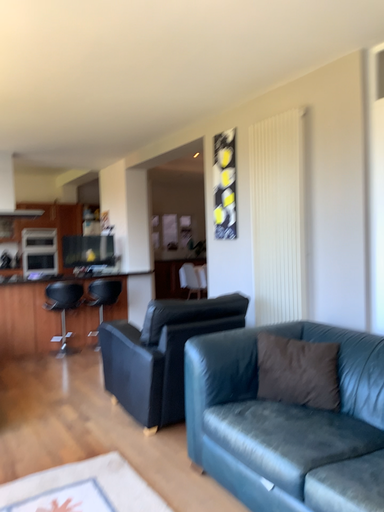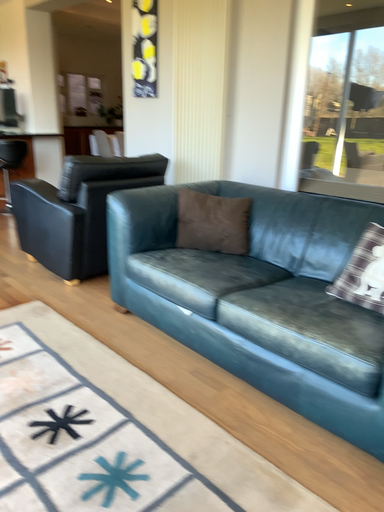
Question: Which way did the camera rotate in the video?

Choices:
 (A) rotated upward
 (B) rotated downward

Answer: (B)